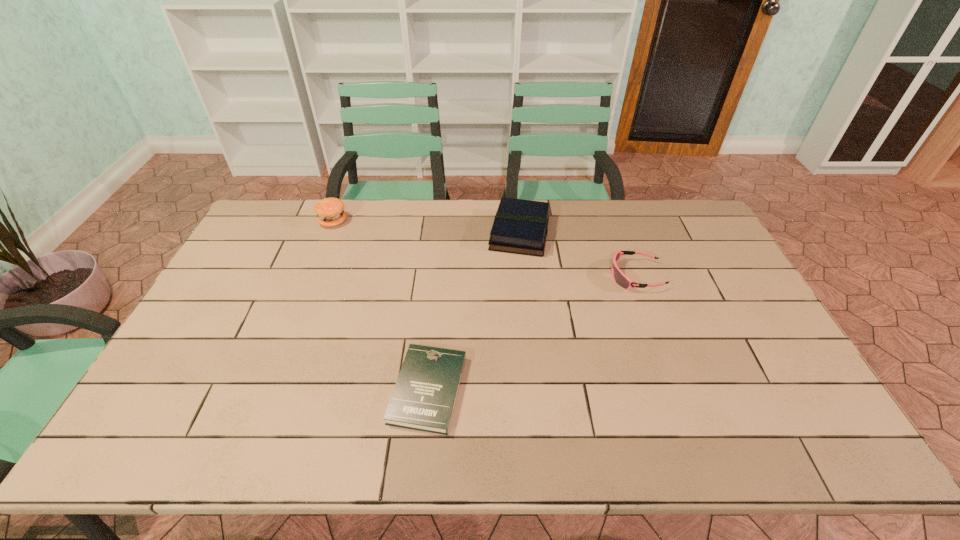
This screenshot has height=540, width=960. Find the location of `vacant space at the far left corner of the desktop`. vacant space at the far left corner of the desktop is located at coordinates (255, 237).

I want to click on vacant region at the near left corner of the desktop, so click(189, 443).

In order to click on free space at the far right corner of the desktop in this screenshot , I will do `click(651, 201)`.

The width and height of the screenshot is (960, 540). What are the coordinates of `empty space between the third farthest object and the tallest object` in the screenshot? It's located at (485, 248).

Where is `vacant point located between the second tallest object and the goggles`? The width and height of the screenshot is (960, 540). vacant point located between the second tallest object and the goggles is located at coordinates (578, 254).

You are a GUI agent. You are given a task and a screenshot of the screen. Output one action in this format:
    pyautogui.click(x=<x>, y=<y>)
    Task: Click on the unoccupied area between the leftmost object and the shortest object
    
    Given the screenshot: What is the action you would take?
    (x=380, y=306)

Where is `free spot between the goggles and the tallest object`? The width and height of the screenshot is (960, 540). free spot between the goggles and the tallest object is located at coordinates (485, 248).

This screenshot has height=540, width=960. What are the coordinates of `free space between the tallest object and the nearer book` in the screenshot? It's located at (380, 306).

Locate an element on the screen. free space between the shorter book and the patty is located at coordinates (380, 306).

Where is `free space between the taller book and the leftmost object`? Image resolution: width=960 pixels, height=540 pixels. free space between the taller book and the leftmost object is located at coordinates (426, 227).